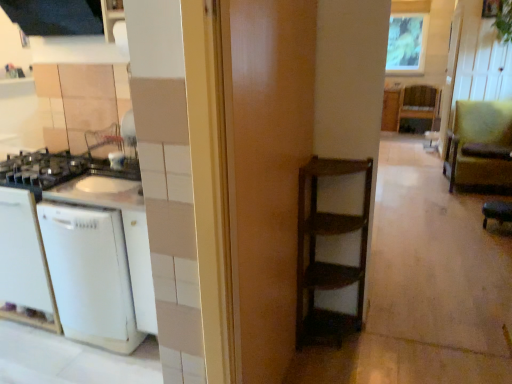
Question: From their relative heights in the image, would you say white matte dishwasher at left is taller or shorter than green fabric armchair at right?

Choices:
 (A) short
 (B) tall

Answer: (A)

Question: Visually, is white matte dishwasher at left positioned to the left or to the right of green fabric armchair at right?

Choices:
 (A) left
 (B) right

Answer: (A)

Question: Estimate the real-world distances between objects in this image. Which object is farther from the white matte dishwasher at left?

Choices:
 (A) green fabric armchair at right
 (B) wooden frame at upper center
 (C) wooden door at center
 (D) green leather bar stool at lower right
 (E) wooden shelf at center

Answer: (B)

Question: Estimate the real-world distances between objects in this image. Which object is closer to the wooden shelf at center?

Choices:
 (A) green leather bar stool at lower right
 (B) wooden door at center
 (C) green fabric armchair at right
 (D) white matte dishwasher at left
 (E) wooden frame at upper center

Answer: (E)